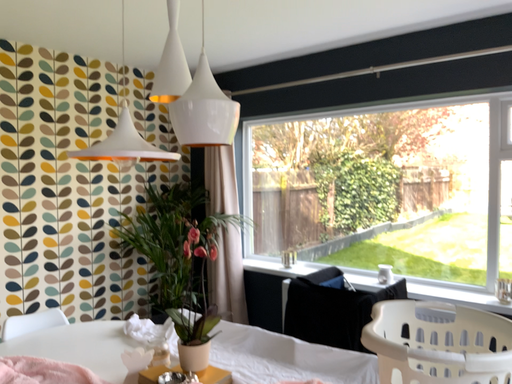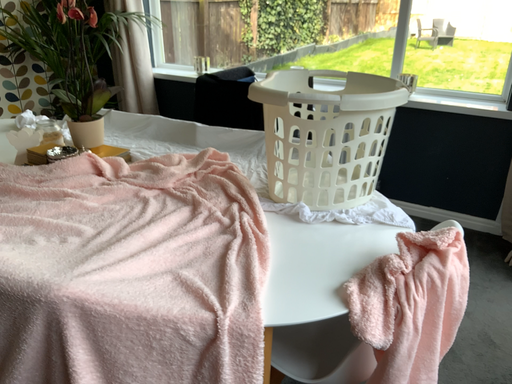
Question: Which way did the camera rotate in the video?

Choices:
 (A) rotated right
 (B) rotated left

Answer: (A)